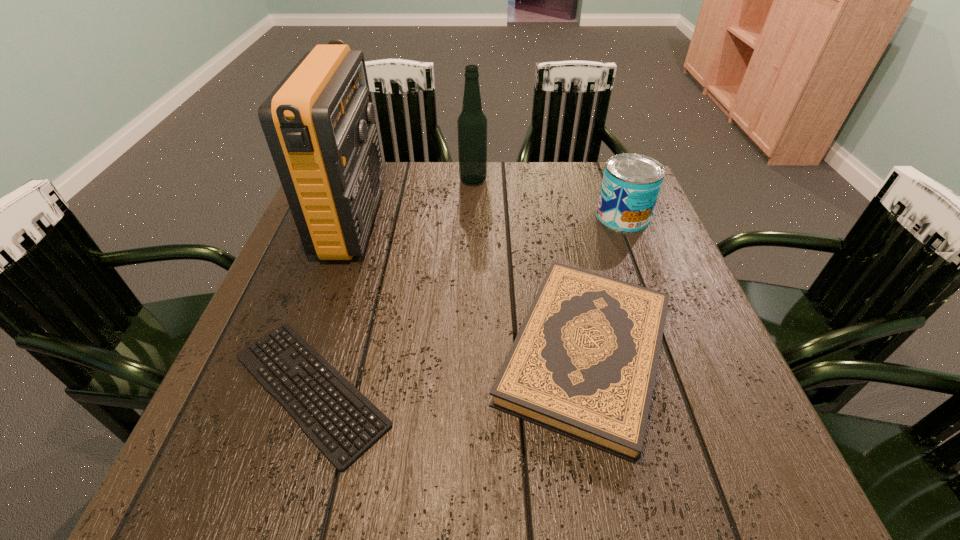
Find the location of `free space in the image that satisfies the following two spatial constraints: 1. on the front-facing side of the radio receiver; 2. on the right side of the shortest object`. free space in the image that satisfies the following two spatial constraints: 1. on the front-facing side of the radio receiver; 2. on the right side of the shortest object is located at coordinates click(294, 389).

You are a GUI agent. You are given a task and a screenshot of the screen. Output one action in this format:
    pyautogui.click(x=<x>, y=<y>)
    Task: Click on the free spot that satisfies the following two spatial constraints: 1. on the back side of the shortest object; 2. on the front-facing side of the radio receiver
    This screenshot has height=540, width=960.
    Given the screenshot: What is the action you would take?
    pyautogui.click(x=364, y=221)

What are the coordinates of `vacant position in the image that satisfies the following two spatial constraints: 1. on the front side of the alcohol; 2. on the right side of the fourth tallest object` in the screenshot? It's located at (469, 353).

You are a GUI agent. You are given a task and a screenshot of the screen. Output one action in this format:
    pyautogui.click(x=<x>, y=<y>)
    Task: Click on the vacant space that satisfies the following two spatial constraints: 1. on the front-facing side of the shortest object; 2. on the left side of the radio receiver
    
    Given the screenshot: What is the action you would take?
    pyautogui.click(x=294, y=389)

Image resolution: width=960 pixels, height=540 pixels. I want to click on free point that satisfies the following two spatial constraints: 1. on the front side of the hardback book; 2. on the left side of the fourth shortest object, so click(x=469, y=353).